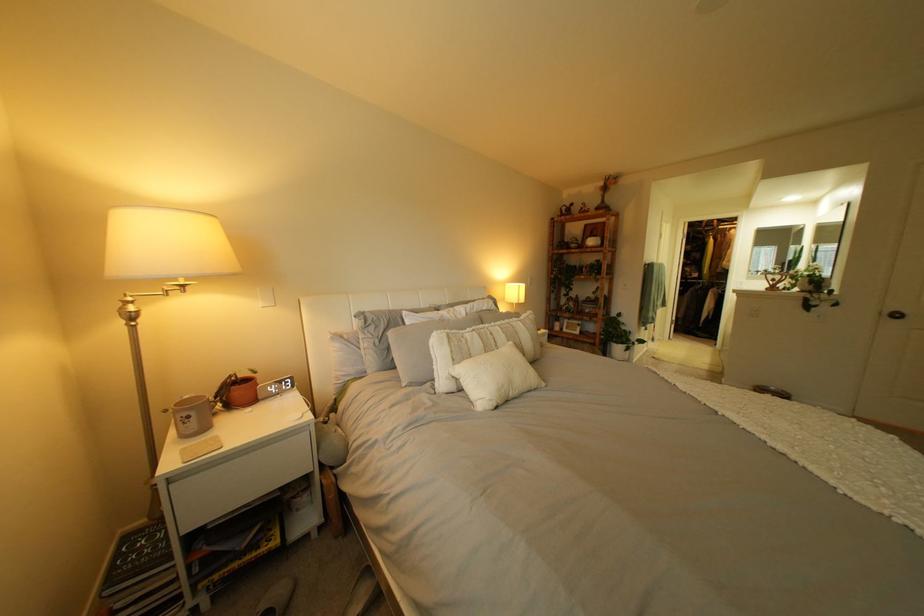
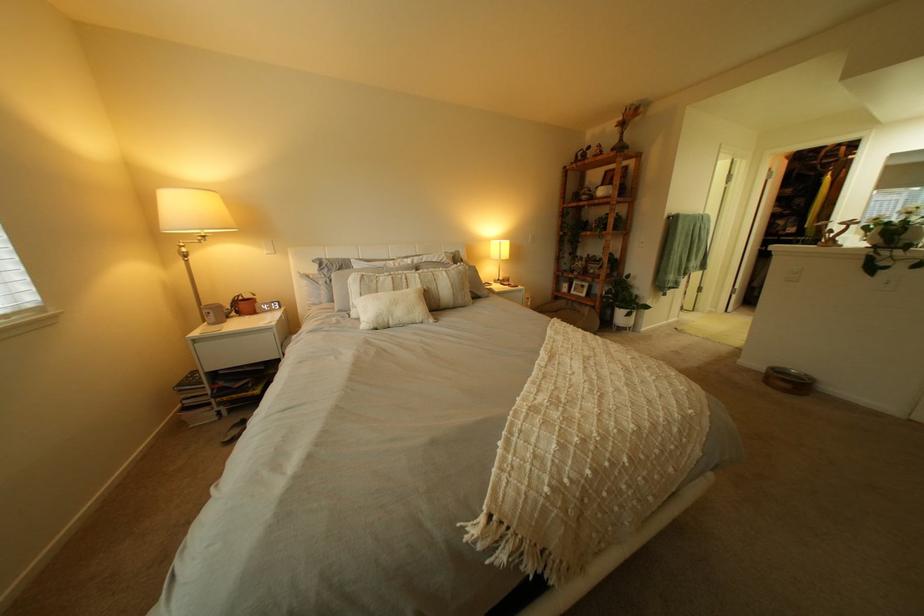
Locate, in the second image, the point that corresponds to the point at 629,341 in the first image.

(633, 305)